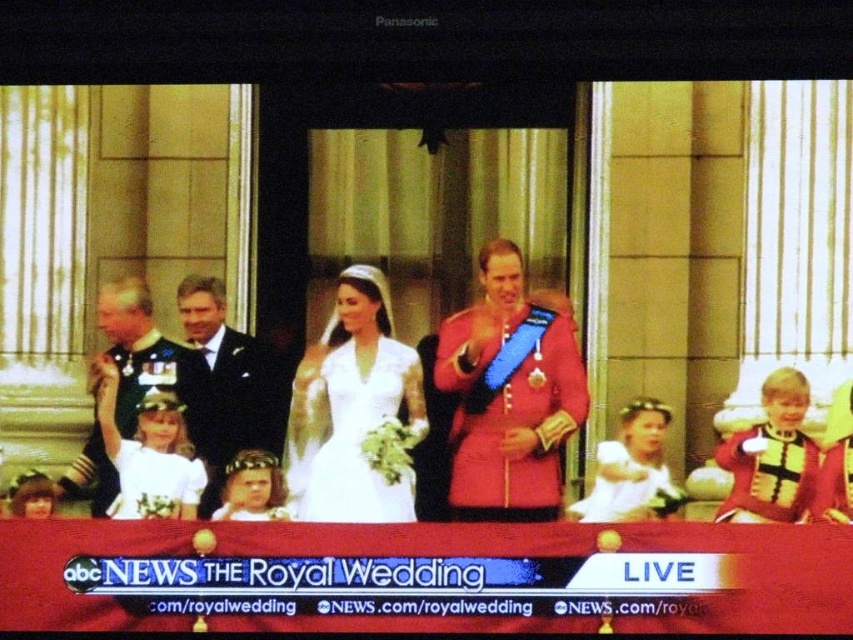
Question: Does shiny red coat at center have a larger size compared to shiny silver uniform at left?

Choices:
 (A) yes
 (B) no

Answer: (B)

Question: Which object is positioned closest to the shiny red coat at center?

Choices:
 (A) shiny silver uniform at left
 (B) white satin dress at center

Answer: (B)

Question: Which of the following is the closest to the observer?

Choices:
 (A) shiny red coat at center
 (B) shiny silver uniform at left

Answer: (A)

Question: Estimate the real-world distances between objects in this image. Which object is closer to the white satin dress at center?

Choices:
 (A) shiny red coat at center
 (B) shiny silver uniform at left

Answer: (A)

Question: Is shiny red coat at center wider than white satin dress at center?

Choices:
 (A) yes
 (B) no

Answer: (A)

Question: Can you confirm if shiny red coat at center is positioned above white satin dress at center?

Choices:
 (A) yes
 (B) no

Answer: (A)